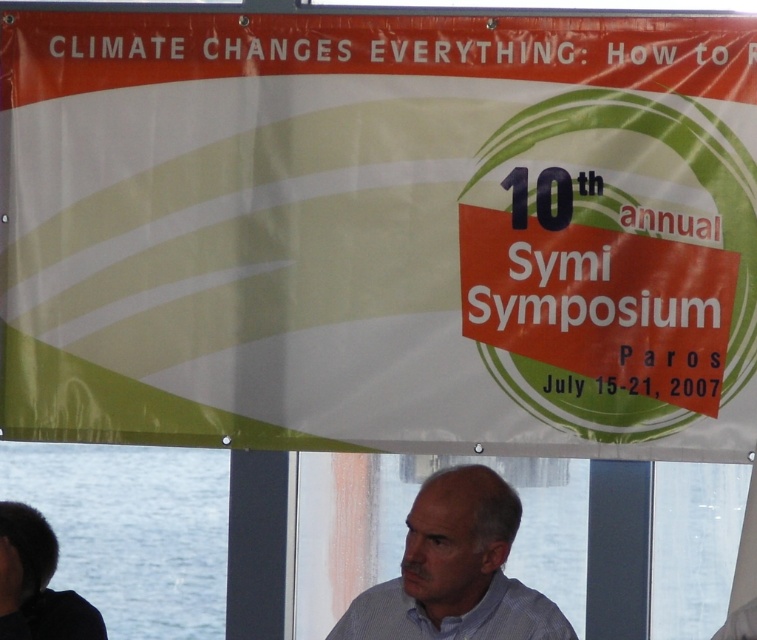
The width and height of the screenshot is (757, 640). What do you see at coordinates (379, 230) in the screenshot?
I see `white fabric banner at upper center` at bounding box center [379, 230].

I want to click on white fabric banner at upper center, so click(x=379, y=230).

The width and height of the screenshot is (757, 640). Find the location of `white fabric banner at upper center`. white fabric banner at upper center is located at coordinates (379, 230).

Is blue water at lower left to the right of dark brown hair at lower left from the viewer's perspective?

Yes, blue water at lower left is to the right of dark brown hair at lower left.

Which is in front, point (195, 554) or point (44, 586)?

Point (44, 586) is more forward.

Between point (107, 544) and point (61, 602), which one is positioned in front?

Point (61, 602)

Where is `blue water at lower left`? The height and width of the screenshot is (640, 757). blue water at lower left is located at coordinates (132, 531).

Who is taller, blue water at lower left or blue shirt at center?

blue water at lower left is taller.

Can you confirm if blue water at lower left is taller than blue shirt at center?

Yes.

This screenshot has height=640, width=757. I want to click on blue water at lower left, so click(x=132, y=531).

Where is `blue water at lower left`? This screenshot has height=640, width=757. blue water at lower left is located at coordinates (132, 531).